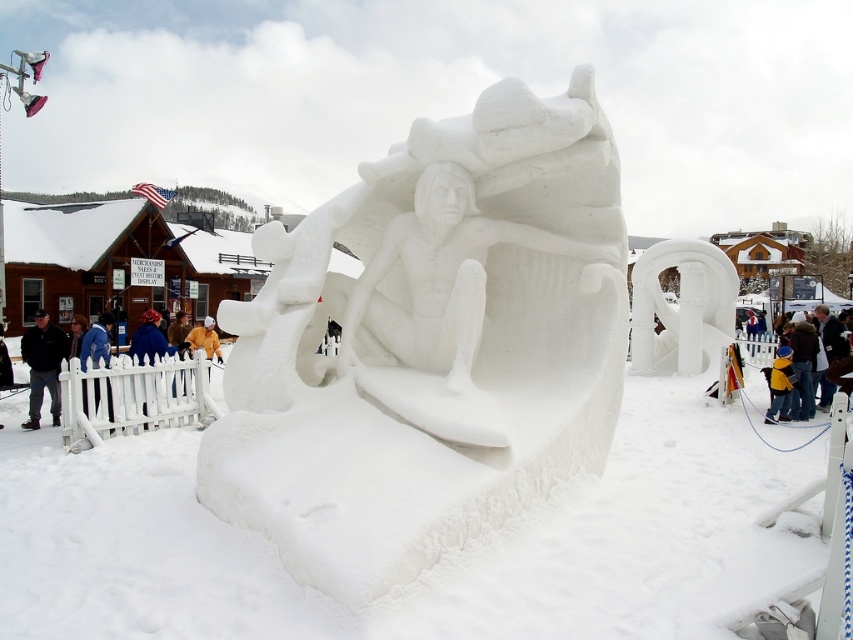
From the picture: Does dark gray jacket at left have a greater height compared to blue woolen hat at left?

Indeed, dark gray jacket at left has a greater height compared to blue woolen hat at left.

Locate an element on the screen. This screenshot has width=853, height=640. dark gray jacket at left is located at coordinates (44, 365).

Is white matte snow sculpture at left below blue woolen hat at left?

Yes, white matte snow sculpture at left is below blue woolen hat at left.

Does white matte snow sculpture at left appear on the left side of blue woolen hat at left?

In fact, white matte snow sculpture at left is to the right of blue woolen hat at left.

Is point (109, 381) in front of point (112, 317)?

Yes.

Identify the location of white matte snow sculpture at left. The height and width of the screenshot is (640, 853). (132, 394).

In order to click on white snow sculpture at center in this screenshot , I will do `click(428, 344)`.

Is white snow sculpture at center further to camera compared to white matte snow sculpture at left?

No, it is in front of white matte snow sculpture at left.

Is point (573, 122) more distant than point (178, 420)?

No, (573, 122) is in front of (178, 420).

Locate an element on the screen. The height and width of the screenshot is (640, 853). white snow sculpture at center is located at coordinates (428, 344).